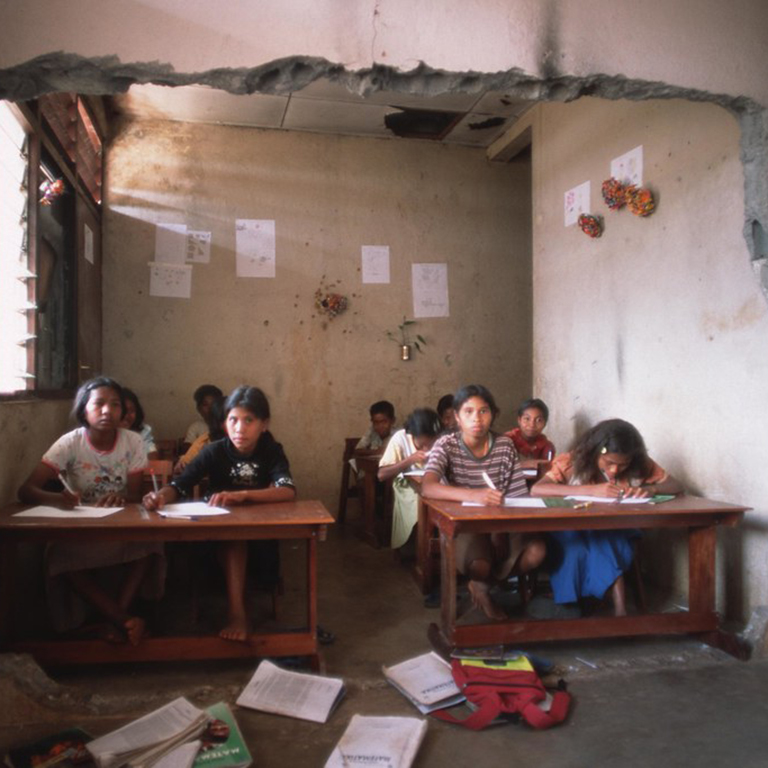
Find the location of a particular element. Image resolution: width=768 pixels, height=768 pixels. desk is located at coordinates (308, 515).